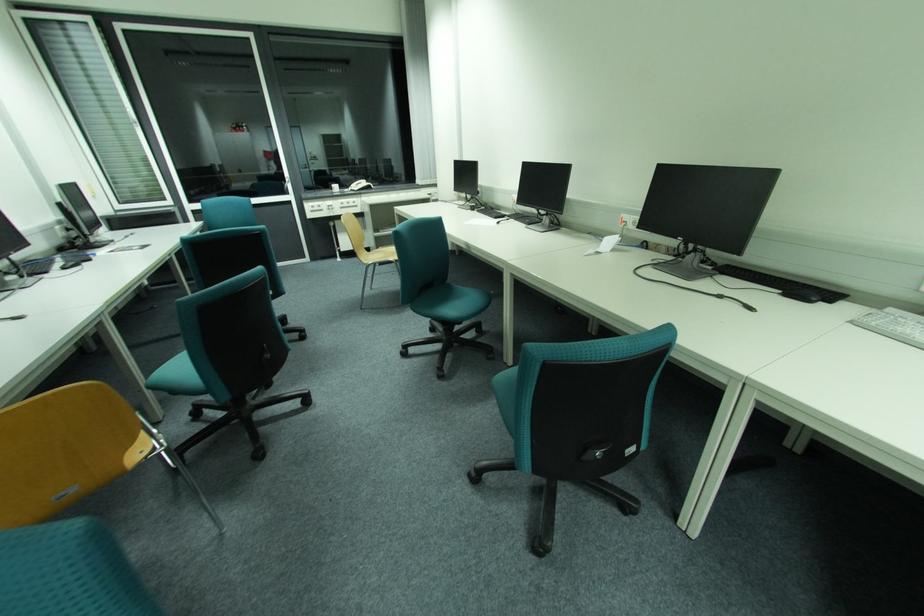
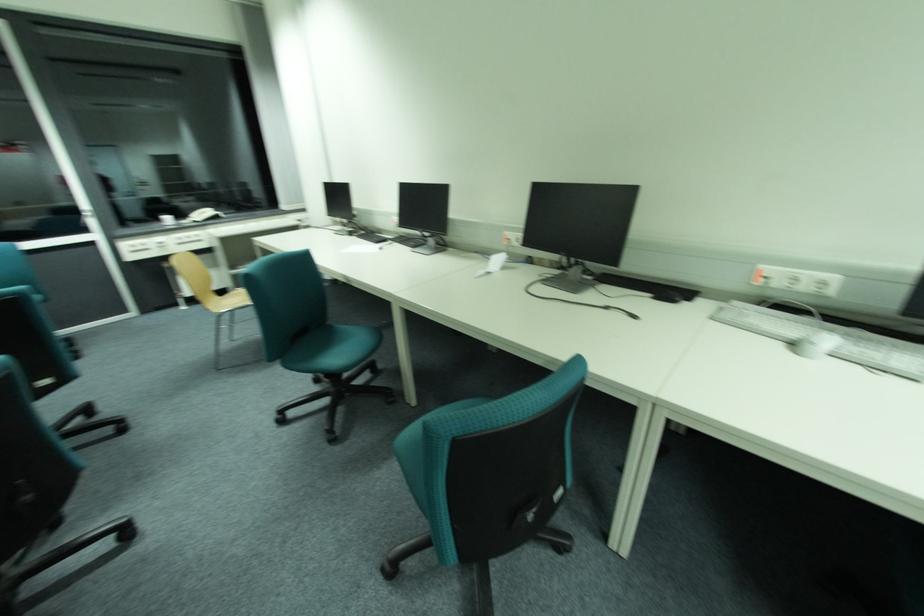
Locate, in the second image, the point that corresponds to [634,508] in the first image.

(568, 551)